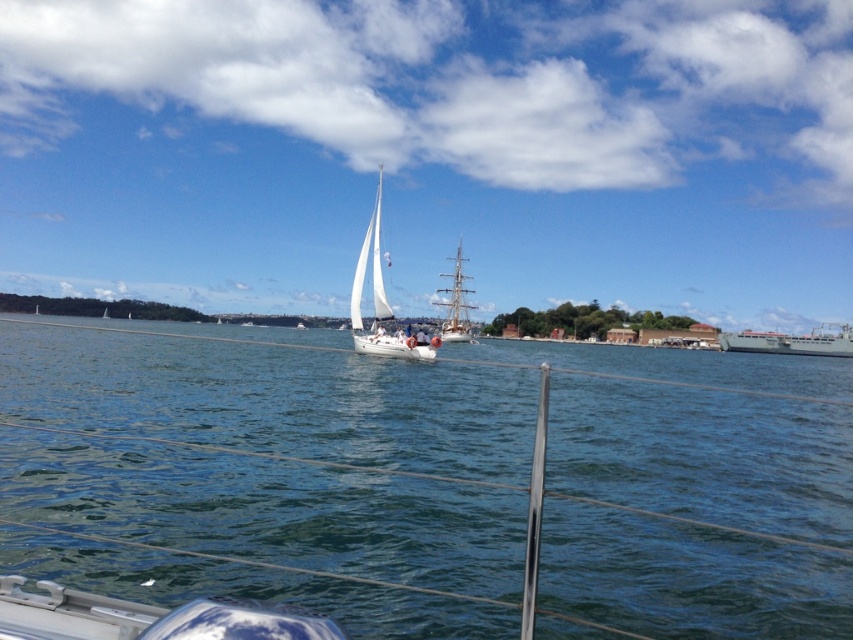
Does gray metallic ship at right have a lesser width compared to white wooden sailboat at center?

No.

Which is more to the right, gray metallic ship at right or white wooden sailboat at center?

From the viewer's perspective, gray metallic ship at right appears more on the right side.

The width and height of the screenshot is (853, 640). In order to click on gray metallic ship at right in this screenshot , I will do `click(792, 340)`.

Is clear blue water at center below white wooden sailboat at center?

Yes.

Who is taller, clear blue water at center or white wooden sailboat at center?

white wooden sailboat at center

At what (x,y) coordinates should I click in order to perform the action: click on clear blue water at center. Please return your answer as a coordinate pair (x, y). Looking at the image, I should click on (450, 467).

Does white matte sailboat at center lie in front of white wooden sailboat at center?

Yes, white matte sailboat at center is closer to the viewer.

Who is more forward, (x=375, y=253) or (x=473, y=337)?

Point (x=375, y=253)

Who is more distant from viewer, (x=421, y=337) or (x=463, y=332)?

The point (x=463, y=332) is more distant.

The height and width of the screenshot is (640, 853). In order to click on white matte sailboat at center in this screenshot , I will do `click(381, 301)`.